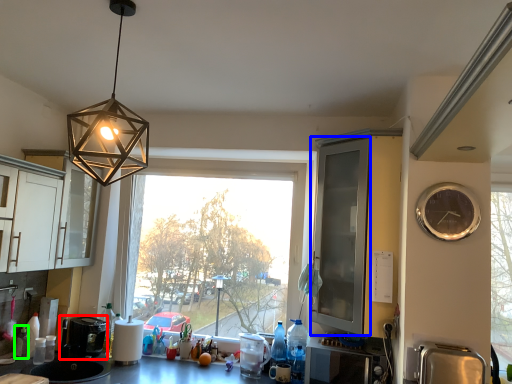
Question: Which is nearer to the coffee machine (highlighted by a red box)? screen door (highlighted by a blue box) or bottle (highlighted by a green box).

Choices:
 (A) screen door
 (B) bottle

Answer: (B)